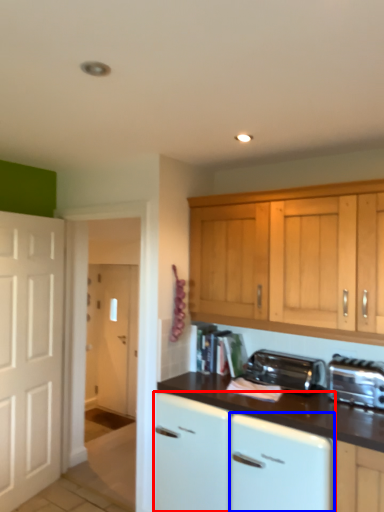
Question: Among these objects, which one is farthest to the camera, cabinetry (highlighted by a red box) or dish washer (highlighted by a blue box)?

Choices:
 (A) cabinetry
 (B) dish washer

Answer: (A)